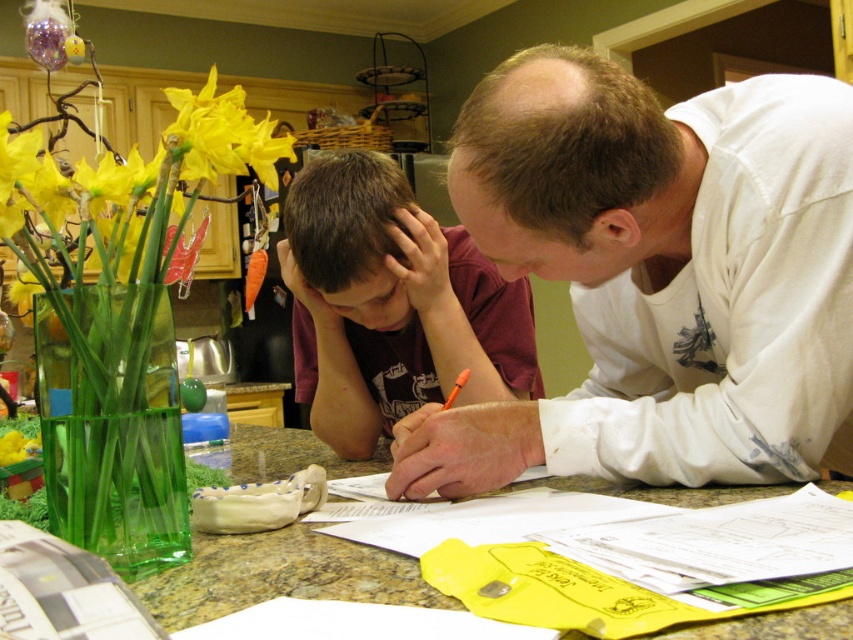
Question: Is green glass vase at left above yellow matte flowers at left?

Choices:
 (A) yes
 (B) no

Answer: (B)

Question: Which object appears farthest from the camera in this image?

Choices:
 (A) yellow matte flowers at left
 (B) green glass vase at center

Answer: (A)

Question: Which point is closer to the camera?

Choices:
 (A) [x=260, y=129]
 (B) [x=801, y=112]
 (C) [x=122, y=508]
 (D) [x=281, y=554]

Answer: (C)

Question: Is dark brown hair at center smaller than yellow matte flowers at left?

Choices:
 (A) no
 (B) yes

Answer: (B)

Question: Is white cotton shirt at upper right closer to camera compared to green glass vase at center?

Choices:
 (A) yes
 (B) no

Answer: (B)

Question: Among these points, which one is farthest from the camera?

Choices:
 (A) (136, 285)
 (B) (88, 268)
 (C) (403, 580)
 (D) (473, 380)

Answer: (B)